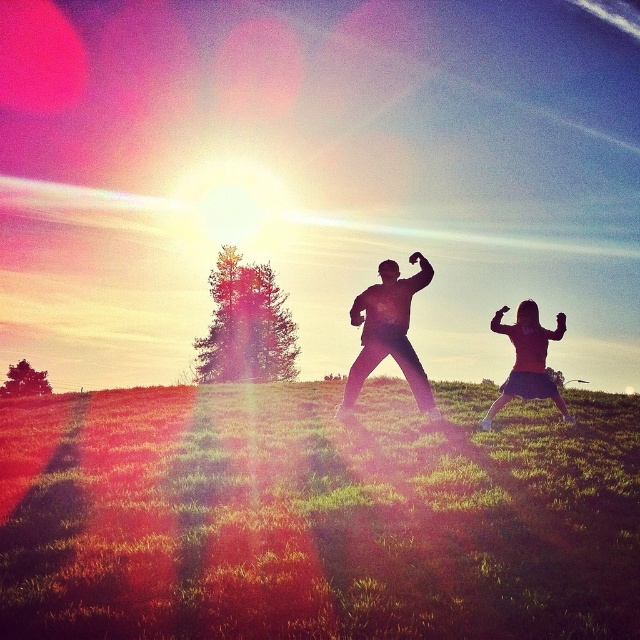
You are standing at the point marked as point (316, 515) in the image. What is the color of the ground beneath your feet?

The point (316, 515) marks green grassy at center, so the ground beneath your feet is green.

You are a photographer trying to capture the sunset. You have a camera with a wide angle lens. You see the green grassy at center and the black matte pants at center in your frame. Which object will occupy more space in your photo?

The green grassy at center will occupy more space in the photo because it has a larger size compared to the black matte pants at center.